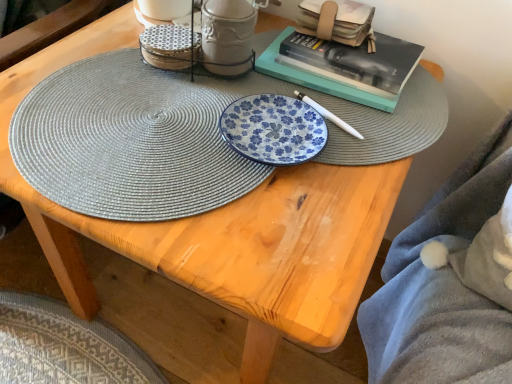
Question: Is matte ceramic mug at upper center, which ranks as the first tableware in right-to-left order, in front of or behind matte gray woven placemat at center in the image?

Choices:
 (A) front
 (B) behind

Answer: (B)

Question: From their relative heights in the image, would you say matte ceramic mug at upper center, which ranks as the first tableware in right-to-left order, is taller or shorter than matte gray woven placemat at center?

Choices:
 (A) short
 (B) tall

Answer: (B)

Question: Estimate the real-world distances between objects in this image. Which object is closer to the soft gray plush blanket at lower right?

Choices:
 (A) matte gray woven placemat at center
 (B) porcelain textured coasters at upper center, marked as the 2th tableware in a right-to-left arrangement
 (C) matte ceramic mug at upper center, which ranks as the first tableware in right-to-left order
 (D) hardcover book at upper right

Answer: (D)

Question: Which is nearer to the porcelain textured coasters at upper center, marked as the 2th tableware in a right-to-left arrangement?

Choices:
 (A) hardcover book at upper right
 (B) matte ceramic mug at upper center, which is the second tableware in left-to-right order
 (C) matte gray woven placemat at center
 (D) soft gray plush blanket at lower right

Answer: (B)